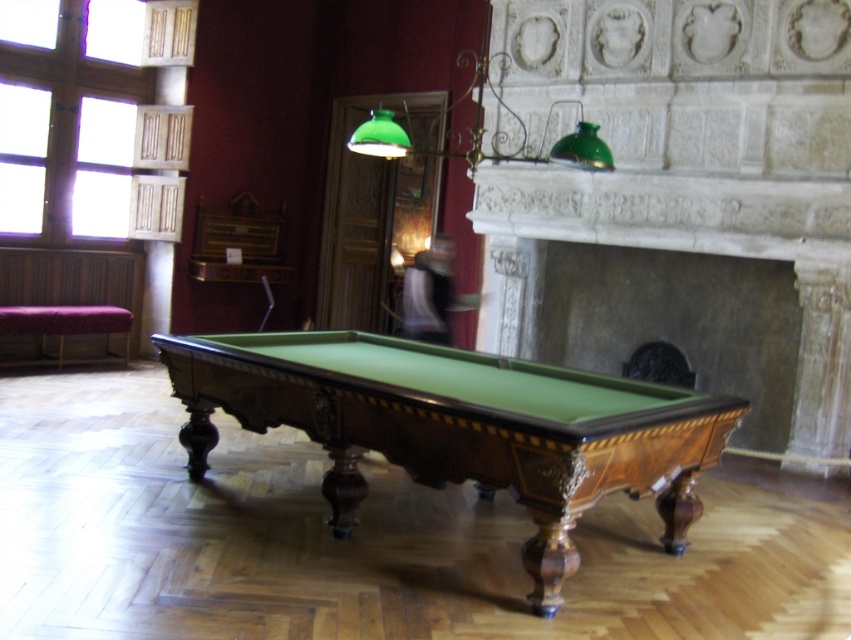
You are standing in the room and want to move from point (698, 168) to point (357, 410). Which direction should you move?

Since point (698, 168) is closer to you than point (357, 410), you should move away from your current position towards the background of the room to reach point (357, 410).

You are standing in the room and want to walk from the green felt pool table at center to the white marble fireplace at center. Which direction should you move in?

You should move to the right to reach the white marble fireplace at center from the green felt pool table at center since the white marble fireplace at center is to the right of the green felt pool table at center.